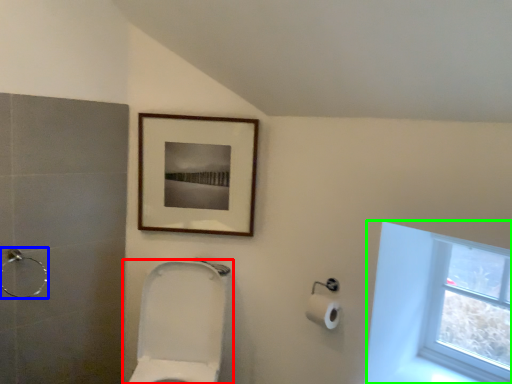
Question: Considering the real-world distances, which object is farthest from toilet (highlighted by a red box)? shower (highlighted by a blue box) or window (highlighted by a green box)?

Choices:
 (A) shower
 (B) window

Answer: (B)